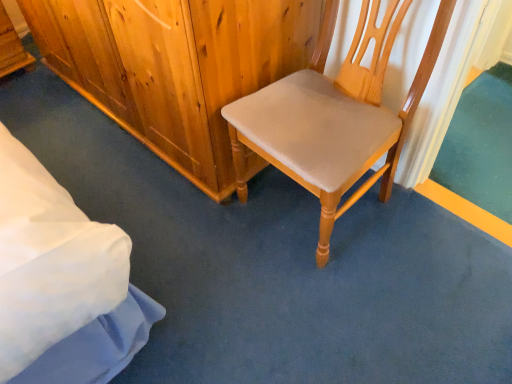
Image resolution: width=512 pixels, height=384 pixels. What do you see at coordinates (334, 116) in the screenshot?
I see `light brown wood chair at center` at bounding box center [334, 116].

What is the approximate width of light brown wood chair at center?

light brown wood chair at center is 21.04 inches in width.

Where is `light brown wood chair at center`? The width and height of the screenshot is (512, 384). light brown wood chair at center is located at coordinates click(334, 116).

Find the location of a particular element. Image resolution: width=512 pixels, height=384 pixels. light brown wood chair at center is located at coordinates (334, 116).